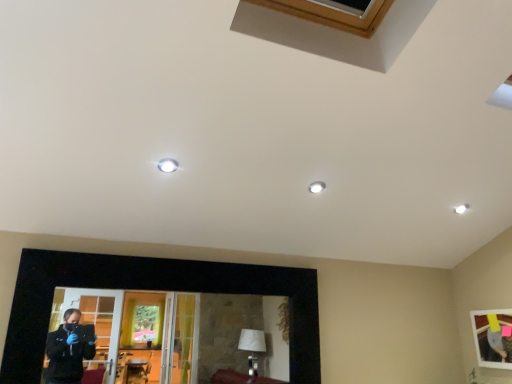
Question: Is black matte picture frame at lower center, which ranks as the second picture frame in right-to-left order, to the right of wooden framed picture at lower right, the first picture frame from the right, from the viewer's perspective?

Choices:
 (A) yes
 (B) no

Answer: (B)

Question: Is black matte picture frame at lower center, which ranks as the 1th picture frame in left-to-right order, thinner than wooden framed picture at lower right, marked as the second picture frame in a left-to-right arrangement?

Choices:
 (A) no
 (B) yes

Answer: (A)

Question: Are black matte picture frame at lower center, which ranks as the second picture frame in right-to-left order, and wooden framed picture at lower right, the first picture frame from the right, far apart?

Choices:
 (A) yes
 (B) no

Answer: (A)

Question: From a real-world perspective, does black matte picture frame at lower center, which ranks as the second picture frame in right-to-left order, sit lower than wooden framed picture at lower right, marked as the second picture frame in a left-to-right arrangement?

Choices:
 (A) no
 (B) yes

Answer: (A)

Question: Does black matte picture frame at lower center, which ranks as the 1th picture frame in left-to-right order, touch wooden framed picture at lower right, the first picture frame from the right?

Choices:
 (A) yes
 (B) no

Answer: (B)

Question: Can wooden framed picture at lower right, marked as the second picture frame in a left-to-right arrangement, be found inside black matte picture frame at lower center, which ranks as the 1th picture frame in left-to-right order?

Choices:
 (A) no
 (B) yes

Answer: (A)

Question: From the image's perspective, is wooden framed picture at lower right, marked as the second picture frame in a left-to-right arrangement, under black matte picture frame at lower center, which ranks as the second picture frame in right-to-left order?

Choices:
 (A) no
 (B) yes

Answer: (B)

Question: From a real-world perspective, is wooden framed picture at lower right, the first picture frame from the right, positioned over black matte picture frame at lower center, which ranks as the second picture frame in right-to-left order, based on gravity?

Choices:
 (A) yes
 (B) no

Answer: (B)

Question: Is the position of wooden framed picture at lower right, the first picture frame from the right, more distant than that of black matte picture frame at lower center, which ranks as the 1th picture frame in left-to-right order?

Choices:
 (A) no
 (B) yes

Answer: (B)

Question: Is wooden framed picture at lower right, marked as the second picture frame in a left-to-right arrangement, bigger than black matte picture frame at lower center, which ranks as the 1th picture frame in left-to-right order?

Choices:
 (A) no
 (B) yes

Answer: (A)

Question: Would you say black matte picture frame at lower center, which ranks as the second picture frame in right-to-left order, is part of wooden framed picture at lower right, marked as the second picture frame in a left-to-right arrangement,'s contents?

Choices:
 (A) yes
 (B) no

Answer: (B)

Question: Is wooden framed picture at lower right, marked as the second picture frame in a left-to-right arrangement, positioned beyond the bounds of black matte picture frame at lower center, which ranks as the second picture frame in right-to-left order?

Choices:
 (A) no
 (B) yes

Answer: (B)

Question: From the image's perspective, relative to black matte picture frame at lower center, which ranks as the second picture frame in right-to-left order, is wooden framed picture at lower right, marked as the second picture frame in a left-to-right arrangement, above or below?

Choices:
 (A) above
 (B) below

Answer: (B)